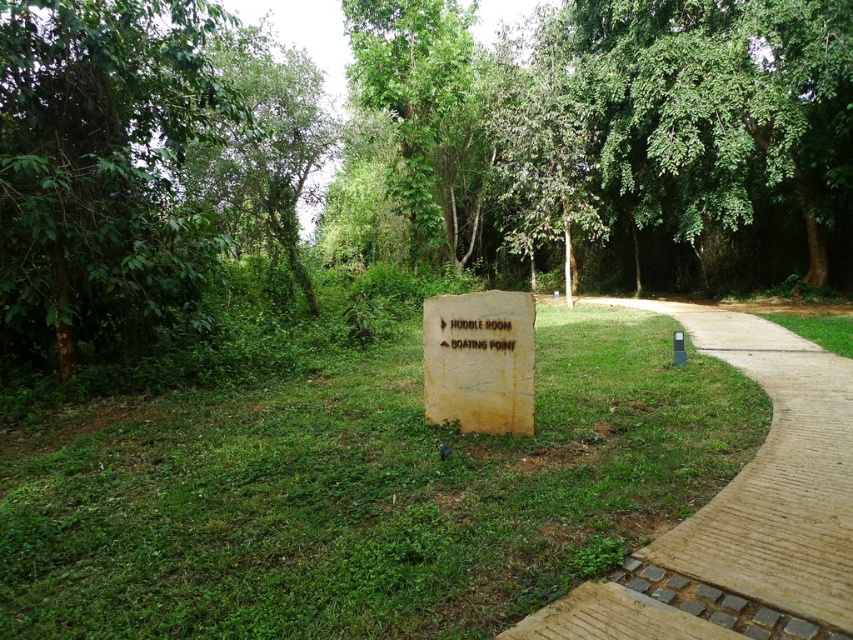
You are planning to take a photo of the green leafy tree at left and the light brown paved path at center right. Which object should you focus on first if you want to capture both in a single frame without moving the camera?

The green leafy tree at left should be focused on first because it is larger in size compared to the light brown paved path at center right, so adjusting focus to the tree ensures both objects are in the frame.

You are a hiker trying to locate the Huddle Room. You see the light brown paved path at center right and the green leafy tree at upper left. Which direction should you head towards to reach the Huddle Room?

The light brown paved path at center right is to the right of the green leafy tree at upper left. Since the signpost points to the left towards the Huddle Room, you should head in the direction opposite of the light brown paved path at center right, towards the left side of the green leafy tree at upper left.

You are planning to take a photo of the light brown paved path at center right and the green leafy tree at upper left. Which object should you focus on first if you want to capture both in the same frame without moving the camera?

The light brown paved path at center right is smaller than the green leafy tree at upper left, so you should focus on the green leafy tree at upper left first to ensure it is in focus and properly framed.